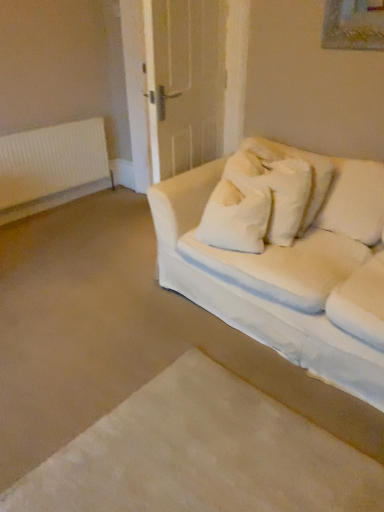
Question: From the image's perspective, is white soft carpet at lower left under white fabric couch at right?

Choices:
 (A) no
 (B) yes

Answer: (B)

Question: Is white soft carpet at lower left surrounding white fabric couch at right?

Choices:
 (A) yes
 (B) no

Answer: (B)

Question: Can you confirm if white soft carpet at lower left is wider than white fabric couch at right?

Choices:
 (A) no
 (B) yes

Answer: (B)

Question: Does white soft carpet at lower left appear on the right side of white fabric couch at right?

Choices:
 (A) yes
 (B) no

Answer: (B)

Question: Is white soft carpet at lower left in front of white fabric couch at right?

Choices:
 (A) yes
 (B) no

Answer: (A)

Question: From their relative heights in the image, would you say white fabric couch at right is taller or shorter than white soft carpet at lower left?

Choices:
 (A) short
 (B) tall

Answer: (B)

Question: Is white fabric couch at right inside or outside of white soft carpet at lower left?

Choices:
 (A) inside
 (B) outside

Answer: (B)

Question: In terms of width, does white fabric couch at right look wider or thinner when compared to white soft carpet at lower left?

Choices:
 (A) thin
 (B) wide

Answer: (A)

Question: Is point (364, 391) positioned closer to the camera than point (344, 462)?

Choices:
 (A) farther
 (B) closer

Answer: (A)

Question: From the image's perspective, is white soft carpet at lower left above or below white fabric couch at right?

Choices:
 (A) below
 (B) above

Answer: (A)

Question: From a real-world perspective, is white soft carpet at lower left physically located above or below white fabric couch at right?

Choices:
 (A) above
 (B) below

Answer: (B)

Question: Considering the positions of point (54, 478) and point (334, 351), is point (54, 478) closer or farther from the camera than point (334, 351)?

Choices:
 (A) farther
 (B) closer

Answer: (B)

Question: Considering the positions of white soft carpet at lower left and white fabric couch at right in the image, is white soft carpet at lower left bigger or smaller than white fabric couch at right?

Choices:
 (A) small
 (B) big

Answer: (A)

Question: Do you think white plastic radiator at left is within white fabric couch at right, or outside of it?

Choices:
 (A) outside
 (B) inside

Answer: (A)

Question: Considering the positions of white plastic radiator at left and white fabric couch at right in the image, is white plastic radiator at left bigger or smaller than white fabric couch at right?

Choices:
 (A) big
 (B) small

Answer: (B)